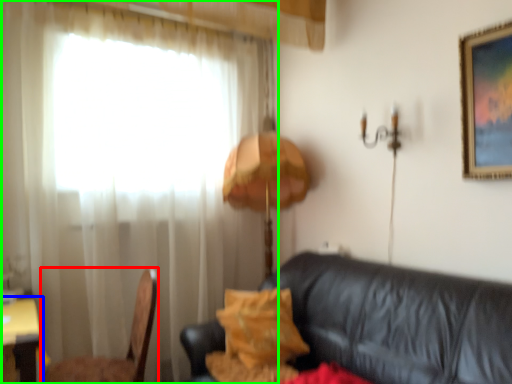
Question: Estimate the real-world distances between objects in this image. Which object is closer to chair (highlighted by a red box), table (highlighted by a blue box) or curtain (highlighted by a green box)?

Choices:
 (A) table
 (B) curtain

Answer: (A)